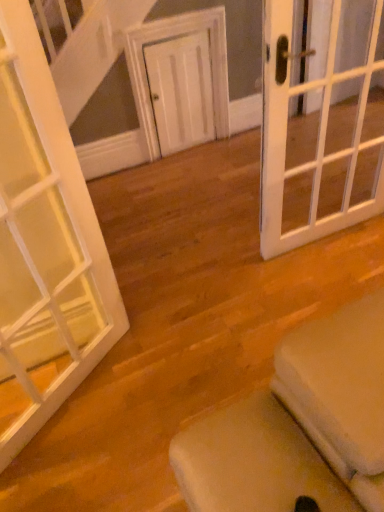
What is the approximate width of white glass door at right, positioned as the 2th door in front-to-back order?

white glass door at right, positioned as the 2th door in front-to-back order, is 4.37 inches wide.

This screenshot has width=384, height=512. In order to click on white glass door at left, which is counted as the 1th door, starting from the front in this screenshot , I will do `click(45, 244)`.

What are the coordinates of `white glass door at right, which is the 1th door in right-to-left order` in the screenshot? It's located at (318, 132).

Can you confirm if white matte door at center, which is counted as the 1th door, starting from the back, is bigger than white glass door at right, which is the 1th door in right-to-left order?

No.

Is white matte door at center, placed as the 2th door when sorted from left to right, aimed at white glass door at right, which is the 1th door in right-to-left order?

Yes, white matte door at center, placed as the 2th door when sorted from left to right, faces towards white glass door at right, which is the 1th door in right-to-left order.

Is white matte door at center, placed as the 2th door when sorted from left to right, to the left of white glass door at right, positioned as the 2th door in front-to-back order, from the viewer's perspective?

Yes.

Is white matte door at center, positioned as the 2th door in right-to-left order, placed right next to white glass door at right, positioned as the 2th door in front-to-back order?

white matte door at center, positioned as the 2th door in right-to-left order, is not next to white glass door at right, positioned as the 2th door in front-to-back order, and they're not touching.

Is white glass door at right, which is the third door from left to right, inside or outside of white glass door at left, which is counted as the 1th door, starting from the front?

white glass door at right, which is the third door from left to right, is spatially situated outside white glass door at left, which is counted as the 1th door, starting from the front.

From the image's perspective, would you say white glass door at right, which is the 1th door in right-to-left order, is positioned over white glass door at left, arranged as the 1th door when viewed from the left?

Yes, from the image's perspective, white glass door at right, which is the 1th door in right-to-left order, is over white glass door at left, arranged as the 1th door when viewed from the left.

Which object is positioned more to the right, white glass door at right, the 2th door from the back, or white glass door at left, positioned as the third door in right-to-left order?

Positioned to the right is white glass door at right, the 2th door from the back.

Is white matte door at center, placed as the 2th door when sorted from left to right, outside of white glass door at left, which is counted as the third door, starting from the back?

Yes, white matte door at center, placed as the 2th door when sorted from left to right, is not within white glass door at left, which is counted as the third door, starting from the back.

Is white matte door at center, which is the third door from front to back, further to camera compared to white glass door at left, which is counted as the 1th door, starting from the front?

Yes, white matte door at center, which is the third door from front to back, is further from the camera.

In terms of height, does white matte door at center, which is the third door from front to back, look taller or shorter compared to white glass door at left, positioned as the third door in right-to-left order?

Clearly, white matte door at center, which is the third door from front to back, is shorter compared to white glass door at left, positioned as the third door in right-to-left order.

Consider the image. Is white matte door at center, placed as the 2th door when sorted from left to right, facing away from white glass door at left, which is counted as the third door, starting from the back?

No, white matte door at center, placed as the 2th door when sorted from left to right, is not facing away from white glass door at left, which is counted as the third door, starting from the back.

Considering the relative positions of white glass door at left, which is counted as the third door, starting from the back, and white glass door at right, which is the third door from left to right, in the image provided, is white glass door at left, which is counted as the third door, starting from the back, to the left or to the right of white glass door at right, which is the third door from left to right,?

white glass door at left, which is counted as the third door, starting from the back, is to the left of white glass door at right, which is the third door from left to right.

Is white glass door at left, which is counted as the third door, starting from the back, behind white glass door at right, which is the third door from left to right?

No, white glass door at left, which is counted as the third door, starting from the back, is in front of white glass door at right, which is the third door from left to right.

Which of these two, white glass door at left, positioned as the third door in right-to-left order, or white glass door at right, positioned as the 2th door in front-to-back order, is bigger?

With larger size is white glass door at left, positioned as the third door in right-to-left order.

Is white glass door at right, the 2th door from the back, a part of white glass door at left, which is counted as the third door, starting from the back?

No, white glass door at right, the 2th door from the back, is not surrounded by white glass door at left, which is counted as the third door, starting from the back.

In terms of height, does white glass door at left, arranged as the 1th door when viewed from the left, look taller or shorter compared to white matte door at center, which is counted as the 1th door, starting from the back?

In the image, white glass door at left, arranged as the 1th door when viewed from the left, appears to be taller than white matte door at center, which is counted as the 1th door, starting from the back.

Considering the points (70, 374) and (187, 135), which point is in front, point (70, 374) or point (187, 135)?

The point (70, 374) is more forward.

Are white glass door at left, which is counted as the 1th door, starting from the front, and white matte door at center, placed as the 2th door when sorted from left to right, making contact?

white glass door at left, which is counted as the 1th door, starting from the front, and white matte door at center, placed as the 2th door when sorted from left to right, are clearly separated.

The width and height of the screenshot is (384, 512). What are the coordinates of `door that is the 2nd one above the white matte door at center, placed as the 2th door when sorted from left to right (from a real-world perspective)` in the screenshot? It's located at (45, 244).

Can you tell me how much white glass door at right, which is the third door from left to right, and white matte door at center, which is the third door from front to back, differ in facing direction?

The facing directions of white glass door at right, which is the third door from left to right, and white matte door at center, which is the third door from front to back, are 0.346 degrees apart.

Is white glass door at right, which is the 1th door in right-to-left order, wider than white matte door at center, which is the third door from front to back?

Yes.

Which object is closer to the camera taking this photo, white glass door at right, which is the 1th door in right-to-left order, or white matte door at center, which is the third door from front to back?

white glass door at right, which is the 1th door in right-to-left order.

Is white glass door at right, the 2th door from the back, touching white matte door at center, which is the third door from front to back?

They are not placed beside each other.

Starting from the white glass door at right, positioned as the 2th door in front-to-back order, which door is the 1st one to the left? Please provide its 2D coordinates.

[(181, 90)]

You are a GUI agent. You are given a task and a screenshot of the screen. Output one action in this format:
    pyautogui.click(x=<x>, y=<y>)
    Task: Click on the 1st door positioned below the white glass door at left, arranged as the 1th door when viewed from the left (from a real-world perspective)
    This screenshot has width=384, height=512.
    Given the screenshot: What is the action you would take?
    pyautogui.click(x=318, y=132)

Which object lies further to the anchor point white glass door at right, the 2th door from the back, white glass door at left, arranged as the 1th door when viewed from the left, or white matte door at center, which is the third door from front to back?

white matte door at center, which is the third door from front to back.

When comparing their distances from white matte door at center, which is counted as the 1th door, starting from the back, does white glass door at right, which is the third door from left to right, or white glass door at left, which is counted as the 1th door, starting from the front, seem further?

white glass door at left, which is counted as the 1th door, starting from the front, is positioned further to the anchor white matte door at center, which is counted as the 1th door, starting from the back.

From the picture: Which object lies nearer to the anchor point white glass door at left, positioned as the third door in right-to-left order, white glass door at right, the 2th door from the back, or white matte door at center, which is counted as the 1th door, starting from the back?

white glass door at right, the 2th door from the back.

In the scene shown: Based on their spatial positions, is white matte door at center, which is counted as the 1th door, starting from the back, or white glass door at right, which is the third door from left to right, closer to white glass door at left, which is counted as the 1th door, starting from the front?

Based on the image, white glass door at right, which is the third door from left to right, appears to be nearer to white glass door at left, which is counted as the 1th door, starting from the front.

Looking at the image, which one is located further to white matte door at center, which is counted as the 1th door, starting from the back, white glass door at left, which is counted as the third door, starting from the back, or white glass door at right, which is the third door from left to right?

white glass door at left, which is counted as the third door, starting from the back, is further to white matte door at center, which is counted as the 1th door, starting from the back.

Estimate the real-world distances between objects in this image. Which object is closer to white glass door at right, positioned as the 2th door in front-to-back order, white matte door at center, which is counted as the 1th door, starting from the back, or white glass door at left, positioned as the third door in right-to-left order?

white glass door at left, positioned as the third door in right-to-left order, is positioned closer to the anchor white glass door at right, positioned as the 2th door in front-to-back order.

Find the location of a particular element. door between white glass door at left, which is counted as the third door, starting from the back, and white matte door at center, which is counted as the 1th door, starting from the back, along the z-axis is located at coordinates pyautogui.click(x=318, y=132).